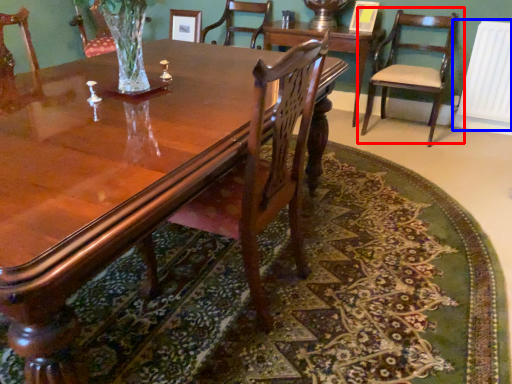
Question: Which of the following is the farthest to the observer, chair (highlighted by a red box) or radiator (highlighted by a blue box)?

Choices:
 (A) chair
 (B) radiator

Answer: (B)